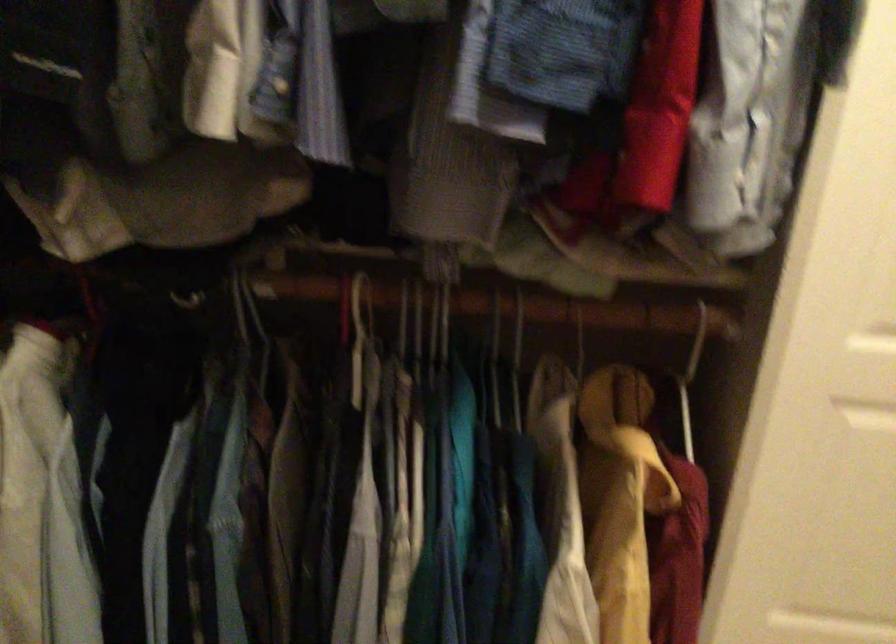
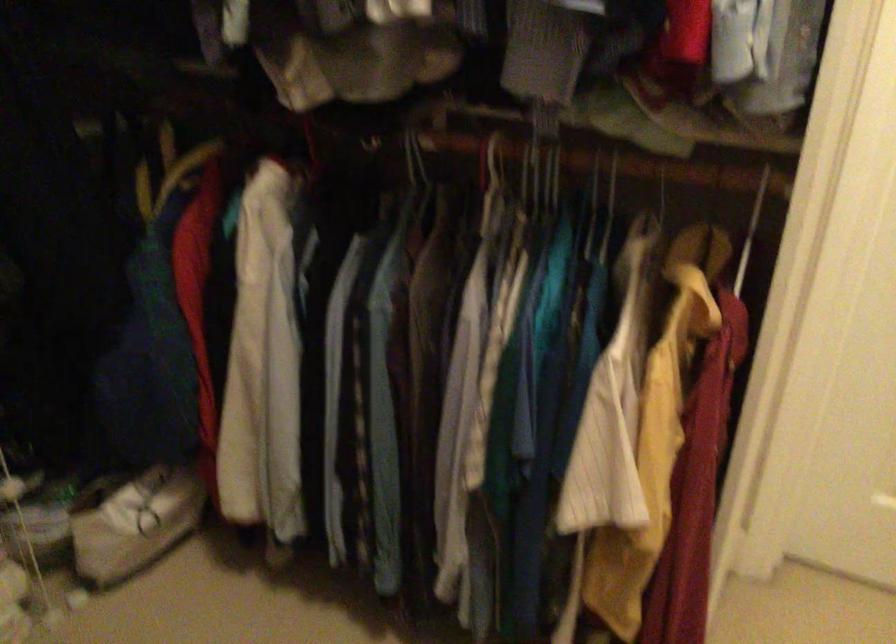
Which direction would the cameraman need to move to produce the second image?

The cameraman walked toward right, backward.